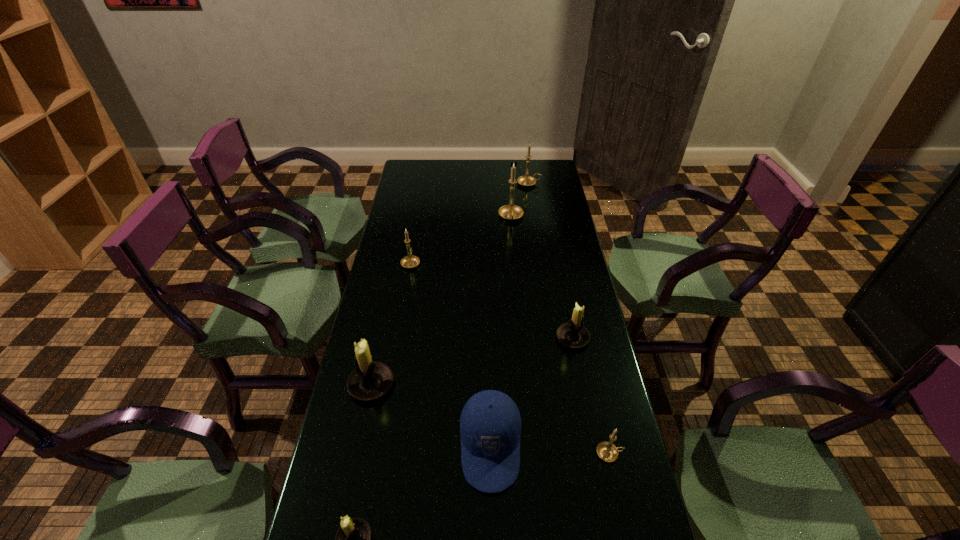
Locate an element on the screen. The height and width of the screenshot is (540, 960). white candle holder that is the second nearest to the smallest white candle holder is located at coordinates (572, 334).

Where is `free location that satisfies the following two spatial constraints: 1. on the handle side of the farthest object; 2. on the front side of the biggest white candle holder`? The image size is (960, 540). free location that satisfies the following two spatial constraints: 1. on the handle side of the farthest object; 2. on the front side of the biggest white candle holder is located at coordinates point(560,384).

At what (x,y) coordinates should I click in order to perform the action: click on vacant space that satisfies the following two spatial constraints: 1. on the handle side of the tallest object; 2. on the left side of the farthest white candle holder. Please return your answer as a coordinate pair (x, y). Image resolution: width=960 pixels, height=540 pixels. Looking at the image, I should click on (521, 338).

Where is `free point that satisfies the following two spatial constraints: 1. on the handle side of the farthest gold candle holder; 2. on the left side of the fifth nearest object`? free point that satisfies the following two spatial constraints: 1. on the handle side of the farthest gold candle holder; 2. on the left side of the fifth nearest object is located at coordinates click(553, 338).

Where is `vacant space that satisfies the following two spatial constraints: 1. on the handle side of the second biggest white candle holder; 2. on the right side of the third nearest gold candle holder`? vacant space that satisfies the following two spatial constraints: 1. on the handle side of the second biggest white candle holder; 2. on the right side of the third nearest gold candle holder is located at coordinates (521, 338).